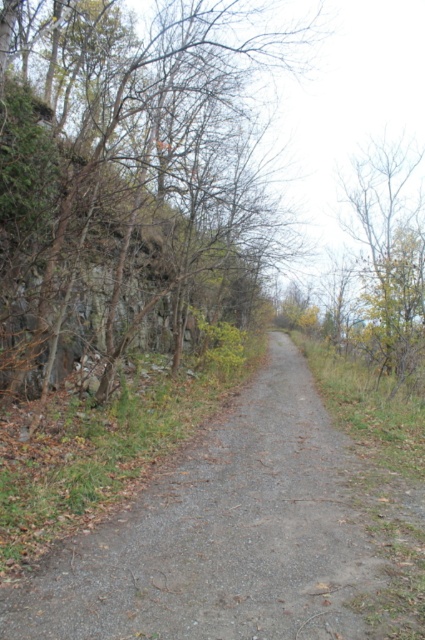
You are standing at point (x=418, y=616) and want to walk to point (x=36, y=145). Based on the scene, is the destination point in front of or behind your current position?

The destination point (x=36, y=145) is behind your current position at (x=418, y=616) according to the spatial description provided.

You are standing on the gray gravel path at center and want to walk towards the brown bark tree at center. Is the tree closer to you or further away than the path?

The brown bark tree at center is further to the viewer than the gray gravel path at center, so the tree is further away from you than the path.